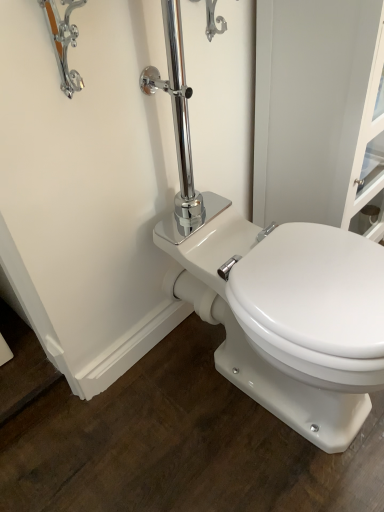
Question: Is the surface of white glossy screen door at upper right in direct contact with white glossy porcelain toilet at center?

Choices:
 (A) no
 (B) yes

Answer: (A)

Question: Is white glossy screen door at upper right wider than white glossy porcelain toilet at center?

Choices:
 (A) no
 (B) yes

Answer: (A)

Question: Does white glossy screen door at upper right have a lesser height compared to white glossy porcelain toilet at center?

Choices:
 (A) yes
 (B) no

Answer: (B)

Question: Is white glossy screen door at upper right facing away from white glossy porcelain toilet at center?

Choices:
 (A) no
 (B) yes

Answer: (A)

Question: Can you confirm if white glossy screen door at upper right is bigger than white glossy porcelain toilet at center?

Choices:
 (A) yes
 (B) no

Answer: (A)

Question: From the image's perspective, would you say white glossy screen door at upper right is positioned over white glossy porcelain toilet at center?

Choices:
 (A) no
 (B) yes

Answer: (B)

Question: Can you confirm if white glossy porcelain toilet at center is shorter than chrome metallic faucet at upper left?

Choices:
 (A) yes
 (B) no

Answer: (B)

Question: Is white glossy porcelain toilet at center located outside chrome metallic faucet at upper left?

Choices:
 (A) yes
 (B) no

Answer: (A)

Question: Does white glossy porcelain toilet at center appear on the right side of chrome metallic faucet at upper left?

Choices:
 (A) no
 (B) yes

Answer: (B)

Question: Considering the relative positions of white glossy porcelain toilet at center and chrome metallic faucet at upper left in the image provided, is white glossy porcelain toilet at center to the left of chrome metallic faucet at upper left from the viewer's perspective?

Choices:
 (A) no
 (B) yes

Answer: (A)

Question: Is white glossy porcelain toilet at center taller than chrome metallic faucet at upper left?

Choices:
 (A) yes
 (B) no

Answer: (A)

Question: Is the surface of white glossy porcelain toilet at center in direct contact with chrome metallic faucet at upper left?

Choices:
 (A) no
 (B) yes

Answer: (A)

Question: Does white glossy screen door at upper right have a greater width compared to chrome metallic faucet at upper left?

Choices:
 (A) no
 (B) yes

Answer: (B)